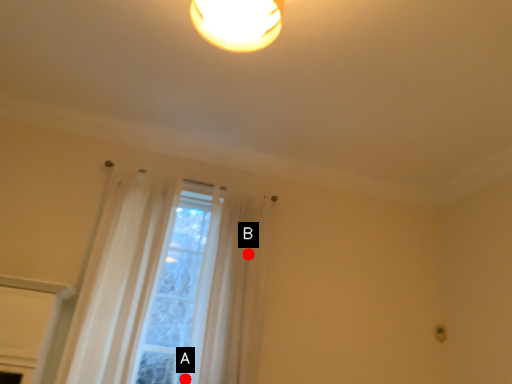
Question: Two points are circled on the image, labeled by A and B beside each circle. Which point is further to the camera?

Choices:
 (A) A is further
 (B) B is further

Answer: (B)